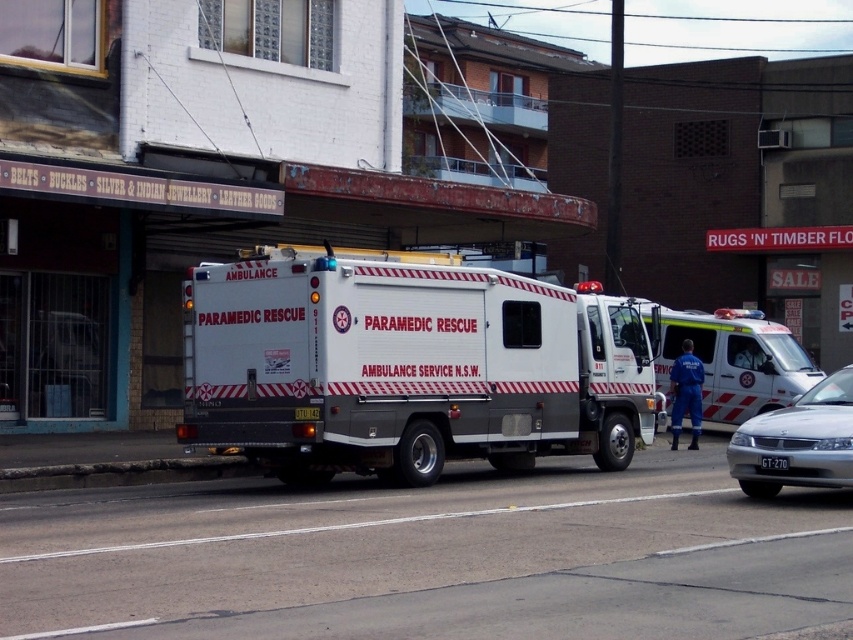
You are a traffic officer assessing the scene. You see the white matte paramedic rescue vehicle at center and the white matte ambulance at center. Which one is positioned higher in the image?

The white matte paramedic rescue vehicle at center is located above the white matte ambulance at center, so it is positioned higher in the image.